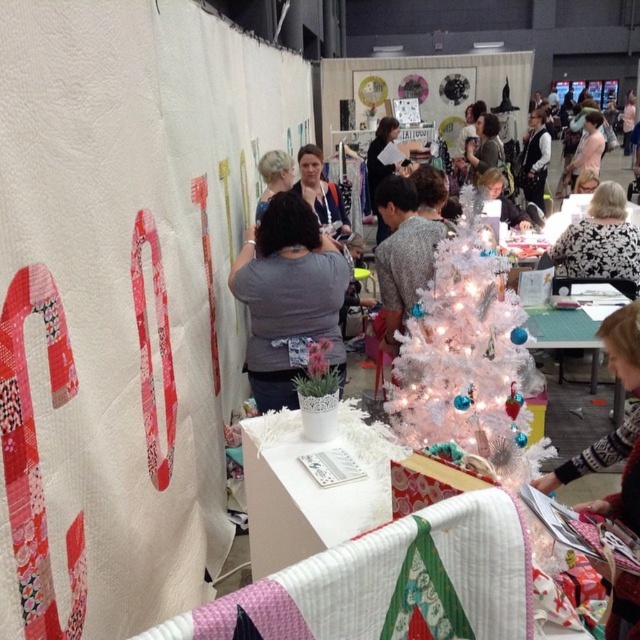
You are at the craft fair and want to place a small gift box between the white glittery christmas tree at center and the gray fabric shirt at center. The gift box is 10 inches long. Will there be enough space between them to fit the gift box?

The white glittery christmas tree at center is 22.64 inches away from the gray fabric shirt at center. Since the gift box is only 10 inches long, there is sufficient space between them to place the gift box.

You are a photographer at the event and want to capture a closeup shot of the gray fabric shirt at center and blonde hair at center. What is the minimum distance you need to maintain between the camera and the subjects to ensure both are in focus?

The gray fabric shirt at center is 1.01 meters away from blonde hair at center. To ensure both are in focus, the camera should be positioned at least 1.01 meters away from the closest subject, which is the blonde hair at center, so that the depth of field can cover the distance between them.